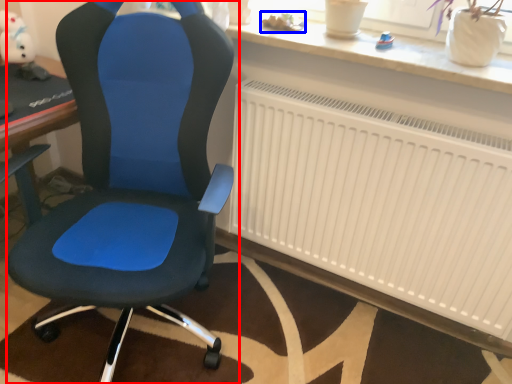
Question: Which point is closer to the camera, chair (highlighted by a red box) or toy (highlighted by a blue box)?

Choices:
 (A) chair
 (B) toy

Answer: (A)